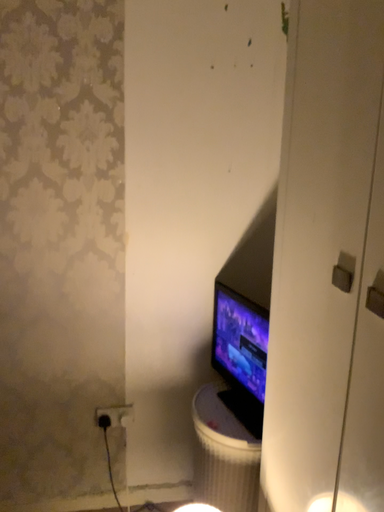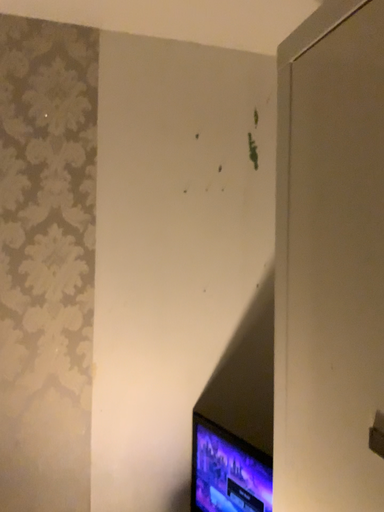
Question: How did the camera likely rotate when shooting the video?

Choices:
 (A) rotated left
 (B) rotated right

Answer: (B)